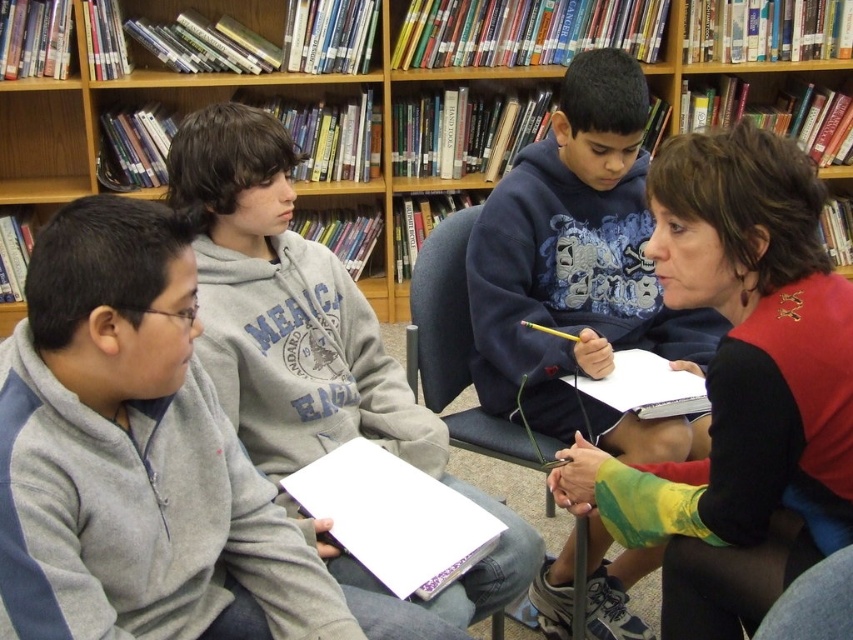
Question: From the image, what is the correct spatial relationship of red sweater at center in relation to gray fleece hoodie at center?

Choices:
 (A) below
 (B) above

Answer: (A)

Question: Can you confirm if gray fleece hoodie at center is smaller than blue fabric chair at lower right?

Choices:
 (A) no
 (B) yes

Answer: (A)

Question: Where is gray fleece hoodie at center located in relation to blue fabric chair at lower right in the image?

Choices:
 (A) right
 (B) left

Answer: (B)

Question: Which of the following is the closest to the observer?

Choices:
 (A) (833, 609)
 (B) (387, 109)
 (C) (543, 288)
 (D) (788, 480)

Answer: (A)

Question: Which point is closer to the camera?

Choices:
 (A) blue fabric chair at lower right
 (B) blue hoodie at center
 (C) gray fleece hoodie at center

Answer: (A)

Question: Which point appears closest to the camera in this image?

Choices:
 (A) (287, 340)
 (B) (74, 605)
 (C) (767, 612)

Answer: (B)